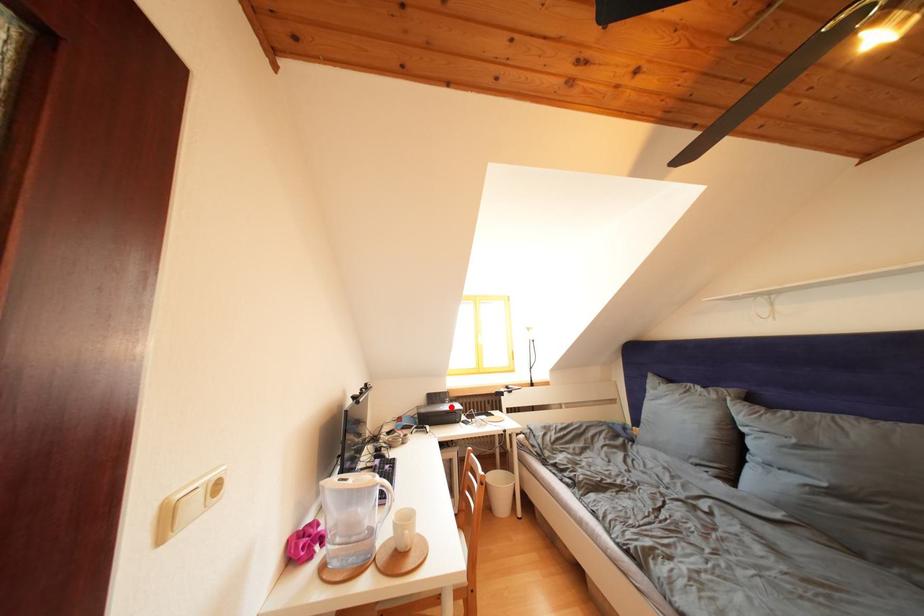
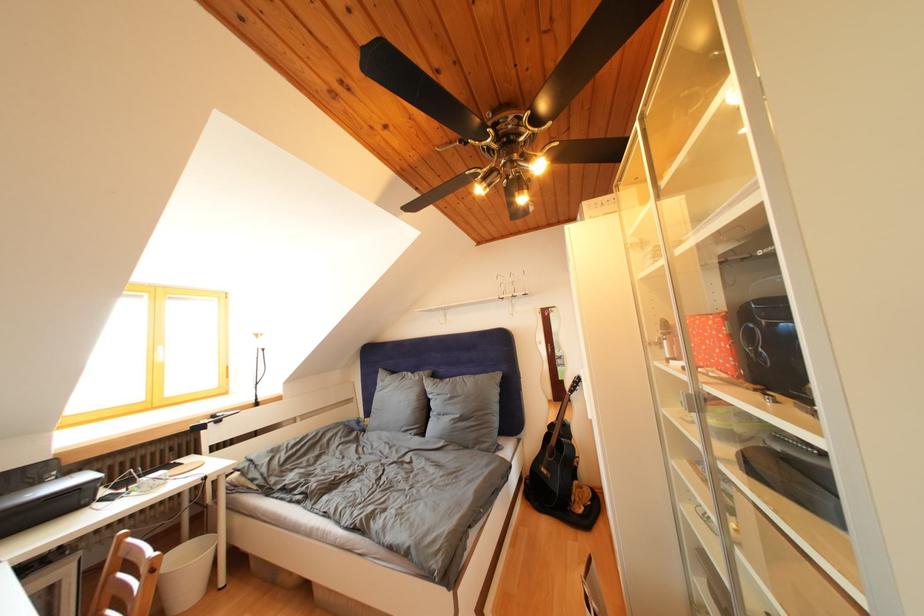
Question: I am providing you with two images of the same scene from different viewpoints. A red point is shown in image1. For the corresponding object point in image2, is it positioned nearer or farther from the camera?

Choices:
 (A) Nearer
 (B) Farther

Answer: (A)